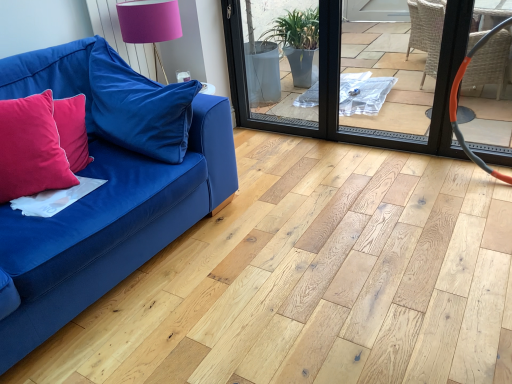
Question: Can you confirm if orange rubber hose at right is wider than transparent plastic screen door at center?

Choices:
 (A) no
 (B) yes

Answer: (B)

Question: From a real-world perspective, is orange rubber hose at right physically below transparent plastic screen door at center?

Choices:
 (A) yes
 (B) no

Answer: (A)

Question: Is orange rubber hose at right oriented away from transparent plastic screen door at center?

Choices:
 (A) no
 (B) yes

Answer: (B)

Question: From the image's perspective, is orange rubber hose at right under transparent plastic screen door at center?

Choices:
 (A) no
 (B) yes

Answer: (B)

Question: Is orange rubber hose at right at the left side of transparent plastic screen door at center?

Choices:
 (A) yes
 (B) no

Answer: (B)

Question: Is transparent plastic screen door at center a part of orange rubber hose at right?

Choices:
 (A) yes
 (B) no

Answer: (B)

Question: From the image's perspective, is velvet red pillow at left, the second pillow in the right-to-left sequence, located above velvet blue couch at left?

Choices:
 (A) yes
 (B) no

Answer: (A)

Question: Does velvet red pillow at left, the 1th pillow in the left-to-right sequence, have a lesser height compared to velvet blue couch at left?

Choices:
 (A) yes
 (B) no

Answer: (A)

Question: From a real-world perspective, is velvet red pillow at left, the 1th pillow in the left-to-right sequence, physically above velvet blue couch at left?

Choices:
 (A) yes
 (B) no

Answer: (A)

Question: From a real-world perspective, is velvet red pillow at left, the second pillow in the right-to-left sequence, under velvet blue couch at left?

Choices:
 (A) yes
 (B) no

Answer: (B)

Question: Can you confirm if velvet red pillow at left, the second pillow in the right-to-left sequence, is thinner than velvet blue couch at left?

Choices:
 (A) yes
 (B) no

Answer: (A)

Question: Is velvet red pillow at left, the 1th pillow in the left-to-right sequence, at the right side of velvet blue couch at left?

Choices:
 (A) no
 (B) yes

Answer: (A)

Question: Considering the relative sizes of velvet blue couch at left and velvet blue pillow at left, arranged as the first pillow when viewed from the right, in the image provided, is velvet blue couch at left smaller than velvet blue pillow at left, arranged as the first pillow when viewed from the right,?

Choices:
 (A) no
 (B) yes

Answer: (A)